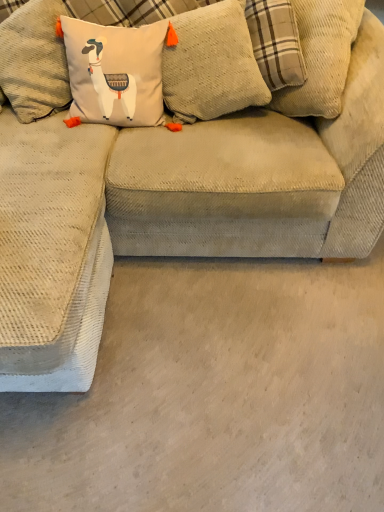
Question: In the image, is beige corduroy couch at center on the left side or the right side of textured beige pillow at upper center?

Choices:
 (A) left
 (B) right

Answer: (B)

Question: Is point (94, 421) positioned closer to the camera than point (210, 96)?

Choices:
 (A) closer
 (B) farther

Answer: (A)

Question: Is beige corduroy couch at center situated inside textured beige pillow at upper center or outside?

Choices:
 (A) inside
 (B) outside

Answer: (B)

Question: Looking at their shapes, would you say textured beige pillow at upper center is wider or thinner than beige corduroy couch at center?

Choices:
 (A) wide
 (B) thin

Answer: (B)

Question: From a real-world perspective, is textured beige pillow at upper center positioned above or below beige corduroy couch at center?

Choices:
 (A) above
 (B) below

Answer: (A)

Question: Is textured beige pillow at upper center situated inside beige corduroy couch at center or outside?

Choices:
 (A) outside
 (B) inside

Answer: (A)

Question: Considering the positions of textured beige pillow at upper center and beige corduroy couch at center in the image, is textured beige pillow at upper center taller or shorter than beige corduroy couch at center?

Choices:
 (A) tall
 (B) short

Answer: (A)